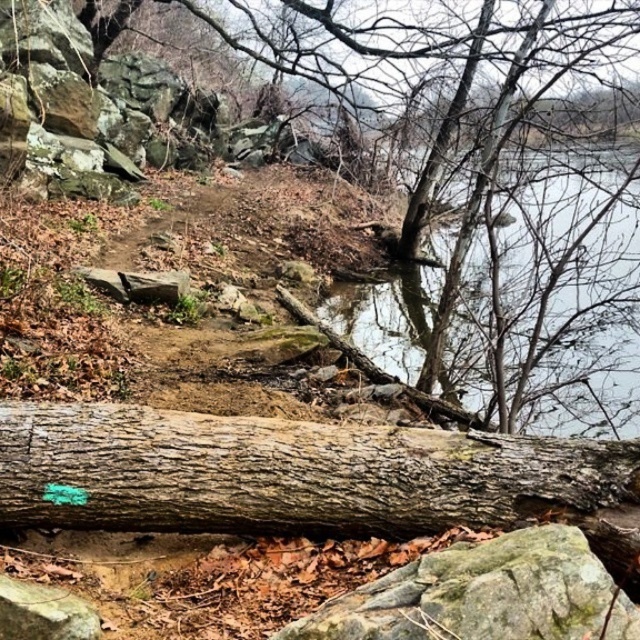
In order to click on clear water at center in this screenshot , I will do `click(550, 310)`.

Is the position of clear water at center less distant than that of green mossy rock at lower center?

No, it is not.

Is point (456, 324) positioned behind point (406, 573)?

Yes, it is behind point (406, 573).

This screenshot has width=640, height=640. I want to click on clear water at center, so click(x=550, y=310).